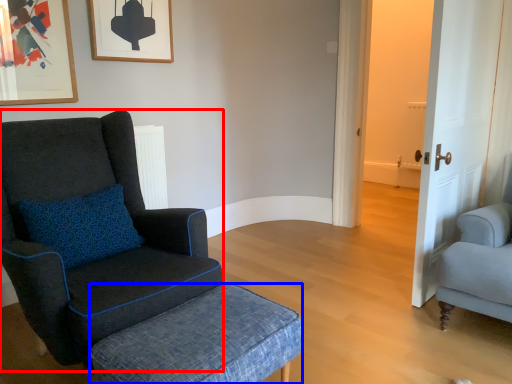
Question: Which of the following is the closest to the observer, chair (highlighted by a red box) or stool (highlighted by a blue box)?

Choices:
 (A) chair
 (B) stool

Answer: (B)